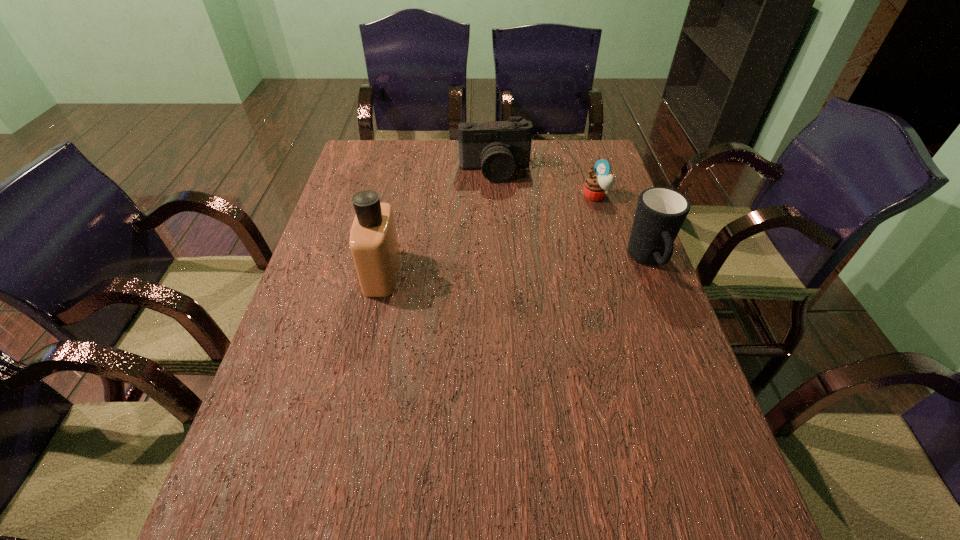
Locate an element on the screen. This screenshot has width=960, height=540. vacant region at the near edge of the desktop is located at coordinates (519, 480).

I want to click on free region at the left edge of the desktop, so click(339, 302).

Find the location of a particular element. The width and height of the screenshot is (960, 540). vacant space at the right edge is located at coordinates (571, 183).

This screenshot has width=960, height=540. I want to click on vacant area at the far left corner of the desktop, so click(x=353, y=163).

Where is `vacant position at the far right corner of the desktop`? The image size is (960, 540). vacant position at the far right corner of the desktop is located at coordinates (583, 164).

Identify the location of vacant space at the near right corner of the desktop. The image size is (960, 540). (723, 484).

The height and width of the screenshot is (540, 960). I want to click on vacant area between the mug and the muffin, so click(x=622, y=228).

The image size is (960, 540). I want to click on blank region between the muffin and the camera, so coord(545,183).

Find the location of a particular element. vacant area that lies between the shortest object and the perfume is located at coordinates (489, 234).

Find the location of a particular element. vacant region between the second object from left to right and the perfume is located at coordinates (439, 222).